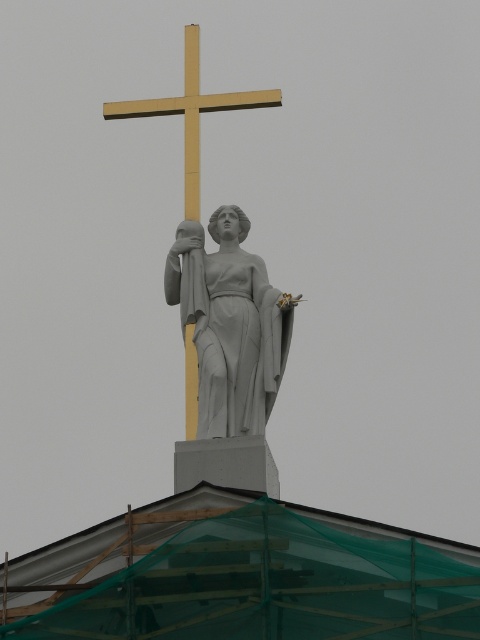
Question: Which object is positioned closest to the gold polished wood cross at upper center?

Choices:
 (A) white marble statue at center
 (B) gold polished cross at center

Answer: (B)

Question: Does white marble statue at center appear under gold polished cross at center?

Choices:
 (A) no
 (B) yes

Answer: (B)

Question: Is white marble statue at center smaller than gold polished cross at center?

Choices:
 (A) no
 (B) yes

Answer: (B)

Question: Is white marble statue at center thinner than gold polished cross at center?

Choices:
 (A) no
 (B) yes

Answer: (B)

Question: Estimate the real-world distances between objects in this image. Which object is farther from the white marble statue at center?

Choices:
 (A) gold polished wood cross at upper center
 (B) gold polished cross at center

Answer: (A)

Question: Which point is farther from the camera taking this photo?

Choices:
 (A) [126, 109]
 (B) [207, 364]

Answer: (A)